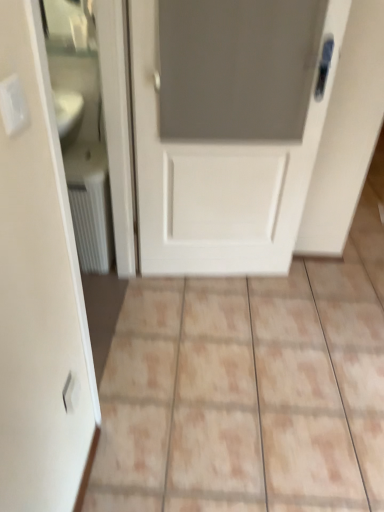
I want to click on white textured radiator at left, so click(90, 205).

The image size is (384, 512). Describe the element at coordinates (90, 205) in the screenshot. I see `white textured radiator at left` at that location.

This screenshot has width=384, height=512. What do you see at coordinates (71, 392) in the screenshot? I see `white plastic electric outlet at lower left, the first electric outlet ordered from the bottom` at bounding box center [71, 392].

Describe the element at coordinates (246, 393) in the screenshot. The width and height of the screenshot is (384, 512). I see `beige ceramic tile at center` at that location.

Locate an element on the screen. The width and height of the screenshot is (384, 512). beige ceramic tile at center is located at coordinates (246, 393).

I want to click on white plastic electric outlet at upper left, the second electric outlet viewed from the back, so click(13, 105).

You are a GUI agent. You are given a task and a screenshot of the screen. Output one action in this format:
    pyautogui.click(x=<x>, y=<y>)
    Task: Click on the white matte door at center
    The width and height of the screenshot is (384, 512).
    Given the screenshot: What is the action you would take?
    pyautogui.click(x=228, y=127)

From the image's perspective, is white plastic electric outlet at upper left, the second electric outlet viewed from the back, under white plastic electric outlet at lower left, the first electric outlet viewed from the back?

Incorrect, from the image's perspective, white plastic electric outlet at upper left, the second electric outlet viewed from the back, is higher than white plastic electric outlet at lower left, the first electric outlet viewed from the back.

Would you say white plastic electric outlet at upper left, the second electric outlet viewed from the back, is a long distance from white plastic electric outlet at lower left, the first electric outlet ordered from the bottom?

No, there isn't a large distance between white plastic electric outlet at upper left, the second electric outlet viewed from the back, and white plastic electric outlet at lower left, the first electric outlet ordered from the bottom.

Is point (28, 120) closer to viewer compared to point (70, 409)?

That is True.

Which of these two, white plastic electric outlet at upper left, the second electric outlet viewed from the back, or white plastic electric outlet at lower left, acting as the 2th electric outlet starting from the front, stands taller?

With more height is white plastic electric outlet at lower left, acting as the 2th electric outlet starting from the front.

Is beige ceramic tile at center inside the boundaries of white plastic electric outlet at upper left, acting as the 2th electric outlet starting from the bottom, or outside?

beige ceramic tile at center is spatially situated outside white plastic electric outlet at upper left, acting as the 2th electric outlet starting from the bottom.

Considering the relative positions of beige ceramic tile at center and white plastic electric outlet at upper left, the first electric outlet when ordered from front to back, in the image provided, is beige ceramic tile at center to the left or to the right of white plastic electric outlet at upper left, the first electric outlet when ordered from front to back,?

From the image, it's evident that beige ceramic tile at center is to the right of white plastic electric outlet at upper left, the first electric outlet when ordered from front to back.

Is beige ceramic tile at center not close to white plastic electric outlet at upper left, acting as the 1th electric outlet starting from the top?

Absolutely, beige ceramic tile at center is distant from white plastic electric outlet at upper left, acting as the 1th electric outlet starting from the top.

Is beige ceramic tile at center in front of white plastic electric outlet at upper left, acting as the 2th electric outlet starting from the bottom?

No, it is not.

Do you think white textured radiator at left is within white matte door at center, or outside of it?

white textured radiator at left is located beyond the bounds of white matte door at center.

Is white textured radiator at left beside white matte door at center?

They are not placed beside each other.

Considering the relative sizes of white textured radiator at left and white matte door at center in the image provided, is white textured radiator at left thinner than white matte door at center?

No.

Can you confirm if white textured radiator at left is taller than white matte door at center?

No.

Is white textured radiator at left a part of white plastic electric outlet at lower left, the first electric outlet ordered from the bottom?

No, white textured radiator at left is not a part of white plastic electric outlet at lower left, the first electric outlet ordered from the bottom.

Which of these two, white plastic electric outlet at lower left, which ranks as the second electric outlet in top-to-bottom order, or white textured radiator at left, is smaller?

white plastic electric outlet at lower left, which ranks as the second electric outlet in top-to-bottom order, is smaller.

Could you tell me if white plastic electric outlet at lower left, the first electric outlet ordered from the bottom, is turned towards white textured radiator at left?

No, white plastic electric outlet at lower left, the first electric outlet ordered from the bottom, is not aimed at white textured radiator at left.

Which electric outlet is the 1st one when counting from the front of the beige ceramic tile at center? Please provide its 2D coordinates.

[(71, 392)]

From the image's perspective, which one is positioned lower, white plastic electric outlet at lower left, acting as the 2th electric outlet starting from the front, or beige ceramic tile at center?

white plastic electric outlet at lower left, acting as the 2th electric outlet starting from the front, from the image's perspective.

Considering the positions of objects white plastic electric outlet at lower left, which ranks as the second electric outlet in top-to-bottom order, and beige ceramic tile at center in the image provided, who is in front, white plastic electric outlet at lower left, which ranks as the second electric outlet in top-to-bottom order, or beige ceramic tile at center?

white plastic electric outlet at lower left, which ranks as the second electric outlet in top-to-bottom order.

In the scene shown: Which of these two, white plastic electric outlet at lower left, the first electric outlet viewed from the back, or white matte door at center, stands taller?

With more height is white matte door at center.

From a real-world perspective, which is physically below, white plastic electric outlet at lower left, the first electric outlet viewed from the back, or white matte door at center?

In real-world perspective, white plastic electric outlet at lower left, the first electric outlet viewed from the back, is lower.

Would you say white plastic electric outlet at lower left, the first electric outlet viewed from the back, is outside white matte door at center?

white plastic electric outlet at lower left, the first electric outlet viewed from the back, is positioned outside white matte door at center.

Considering the relative sizes of white plastic electric outlet at lower left, the first electric outlet viewed from the back, and white matte door at center in the image provided, is white plastic electric outlet at lower left, the first electric outlet viewed from the back, thinner than white matte door at center?

Yes.

Does white plastic electric outlet at upper left, the first electric outlet when ordered from front to back, have a lesser width compared to white matte door at center?

Yes, white plastic electric outlet at upper left, the first electric outlet when ordered from front to back, is thinner than white matte door at center.

Locate an element on the screen. door that is above the white plastic electric outlet at upper left, the first electric outlet when ordered from front to back (from the image's perspective) is located at coordinates (228, 127).

From the image's perspective, is white plastic electric outlet at upper left, acting as the 2th electric outlet starting from the bottom, beneath white matte door at center?

Correct, white plastic electric outlet at upper left, acting as the 2th electric outlet starting from the bottom, appears lower than white matte door at center in the image.

Looking at this image, would you consider white plastic electric outlet at upper left, the first electric outlet when ordered from front to back, to be distant from white matte door at center?

white plastic electric outlet at upper left, the first electric outlet when ordered from front to back, is positioned a significant distance from white matte door at center.

What are the coordinates of `electric outlet on the right of white plastic electric outlet at lower left, acting as the 2th electric outlet starting from the front` in the screenshot? It's located at (13, 105).

From a real-world perspective, which electric outlet is the 2nd one above the beige ceramic tile at center? Please provide its 2D coordinates.

[(13, 105)]

When comparing their distances from white matte door at center, does beige ceramic tile at center or white textured radiator at left seem closer?

white textured radiator at left.

When comparing their distances from white plastic electric outlet at upper left, the first electric outlet when ordered from front to back, does white matte door at center or white plastic electric outlet at lower left, the first electric outlet ordered from the bottom, seem further?

white matte door at center is positioned further to the anchor white plastic electric outlet at upper left, the first electric outlet when ordered from front to back.

Looking at the image, which one is located closer to white textured radiator at left, white plastic electric outlet at upper left, the second electric outlet viewed from the back, or beige ceramic tile at center?

beige ceramic tile at center is positioned closer to the anchor white textured radiator at left.

Considering their positions, is white matte door at center positioned further to white plastic electric outlet at upper left, acting as the 1th electric outlet starting from the top, than beige ceramic tile at center?

The object further to white plastic electric outlet at upper left, acting as the 1th electric outlet starting from the top, is beige ceramic tile at center.

Looking at the image, which one is located further to beige ceramic tile at center, white plastic electric outlet at lower left, which ranks as the second electric outlet in top-to-bottom order, or white plastic electric outlet at upper left, acting as the 2th electric outlet starting from the bottom?

white plastic electric outlet at upper left, acting as the 2th electric outlet starting from the bottom, is positioned further to the anchor beige ceramic tile at center.

Looking at the image, which one is located further to white matte door at center, beige ceramic tile at center or white plastic electric outlet at upper left, acting as the 2th electric outlet starting from the bottom?

Among the two, white plastic electric outlet at upper left, acting as the 2th electric outlet starting from the bottom, is located further to white matte door at center.

Looking at the image, which one is located closer to white matte door at center, white plastic electric outlet at upper left, the first electric outlet when ordered from front to back, or beige ceramic tile at center?

beige ceramic tile at center.

Estimate the real-world distances between objects in this image. Which object is further from beige ceramic tile at center, white plastic electric outlet at upper left, acting as the 2th electric outlet starting from the bottom, or white matte door at center?

white plastic electric outlet at upper left, acting as the 2th electric outlet starting from the bottom, lies further to beige ceramic tile at center than the other object.

You are a GUI agent. You are given a task and a screenshot of the screen. Output one action in this format:
    pyautogui.click(x=<x>, y=<y>)
    Task: Click on the door positioned between white plastic electric outlet at upper left, acting as the 1th electric outlet starting from the top, and white textured radiator at left from near to far
    The width and height of the screenshot is (384, 512).
    Given the screenshot: What is the action you would take?
    pyautogui.click(x=228, y=127)

This screenshot has height=512, width=384. What are the coordinates of `door between white textured radiator at left and beige ceramic tile at center in the horizontal direction` in the screenshot? It's located at (228, 127).

Where is `door between white plastic electric outlet at upper left, acting as the 1th electric outlet starting from the top, and beige ceramic tile at center`? The height and width of the screenshot is (512, 384). door between white plastic electric outlet at upper left, acting as the 1th electric outlet starting from the top, and beige ceramic tile at center is located at coordinates (228, 127).

Where is `ceramic tile between white plastic electric outlet at upper left, acting as the 1th electric outlet starting from the top, and white textured radiator at left, along the z-axis`? This screenshot has width=384, height=512. ceramic tile between white plastic electric outlet at upper left, acting as the 1th electric outlet starting from the top, and white textured radiator at left, along the z-axis is located at coordinates (246, 393).